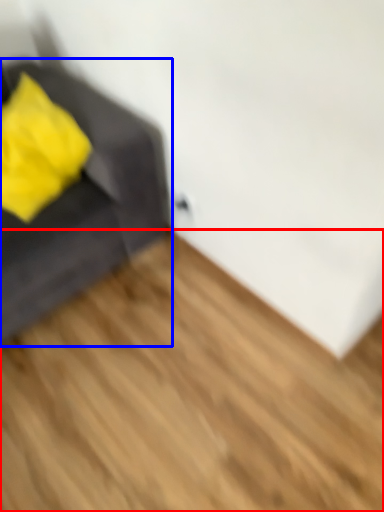
Question: Which object appears closest to the camera in this image, hardwood (highlighted by a red box) or furniture (highlighted by a blue box)?

Choices:
 (A) hardwood
 (B) furniture

Answer: (A)